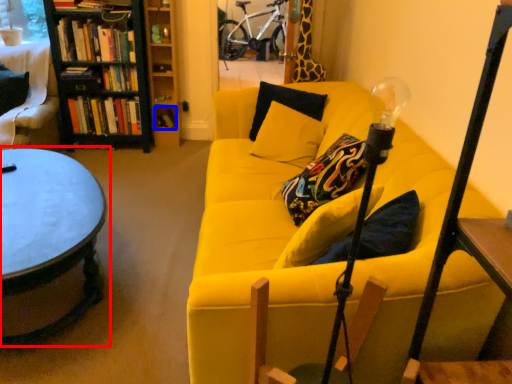
Question: Among these objects, which one is farthest to the camera, coffee table (highlighted by a red box) or book (highlighted by a blue box)?

Choices:
 (A) coffee table
 (B) book

Answer: (B)